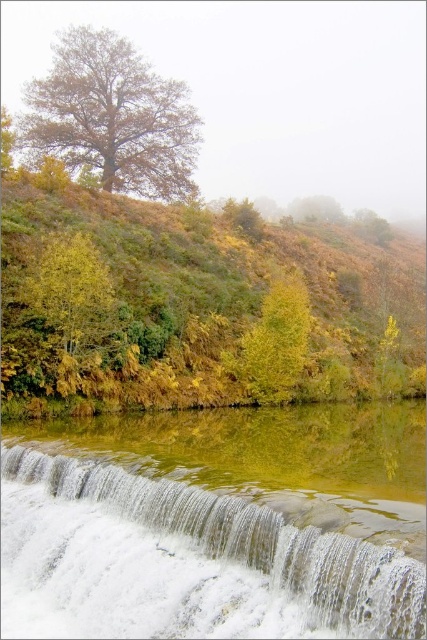
Question: Which point appears farthest from the camera in this image?

Choices:
 (A) (303, 296)
 (B) (157, 616)
 (C) (333, 269)

Answer: (C)

Question: Which is nearer to the brown matte tree at upper left?

Choices:
 (A) green leafy hillside at lower left
 (B) white frothy water at lower center
 (C) yellow-green leafy tree at center

Answer: (A)

Question: Does green leafy hillside at lower left appear on the right side of white frothy water at lower center?

Choices:
 (A) yes
 (B) no

Answer: (A)

Question: Can you confirm if green leafy hillside at lower left is smaller than brown matte tree at upper left?

Choices:
 (A) yes
 (B) no

Answer: (B)

Question: Can you confirm if green leafy hillside at lower left is bigger than brown matte tree at upper left?

Choices:
 (A) no
 (B) yes

Answer: (B)

Question: Which point is farther to the camera?

Choices:
 (A) (175, 125)
 (B) (324, 364)

Answer: (A)